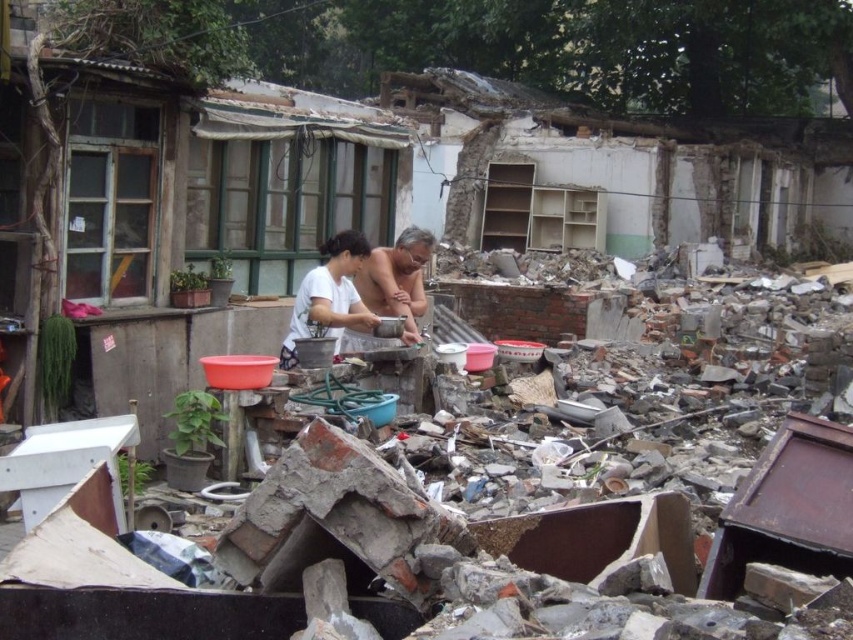
You are a construction worker who needs to place a 10 inch tool between the white matte shirt at center and the smooth skin man at center. Is there enough space?

The white matte shirt at center is 7.27 inches from smooth skin man at center. Since the tool is 10 inches long, it would not fit between them as the distance is shorter than the tool.

Looking at this image, you are a photographer trying to capture a portrait of both the white matte shirt at center and the smooth skin man at center in the scene. Since you want to ensure both are clearly visible, which object should you focus on first to ensure proper focus, considering their sizes?

The white matte shirt at center has a larger size compared to the smooth skin man at center, so focusing on the white matte shirt at center first would ensure proper focus since it occupies more space in the frame.

From the picture: You are a photographer trying to capture the scene of the two people at the center. You want to frame the white matte shirt at center and the smooth skin man at center in your shot. Which one should you place on the left side of your frame?

The white matte shirt at center should be placed on the left side of your frame because it is already positioned to the left of the smooth skin man at center in the scene.